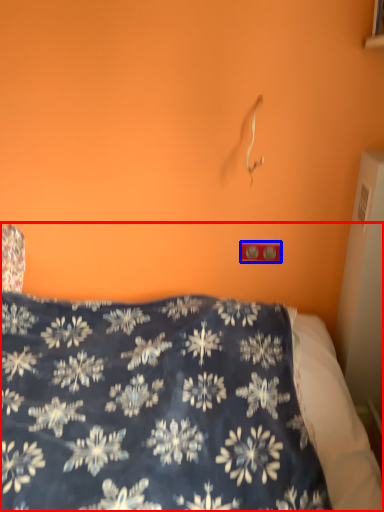
Question: Which of the following is the closest to the observer, bed (highlighted by a red box) or electric outlet (highlighted by a blue box)?

Choices:
 (A) bed
 (B) electric outlet

Answer: (A)